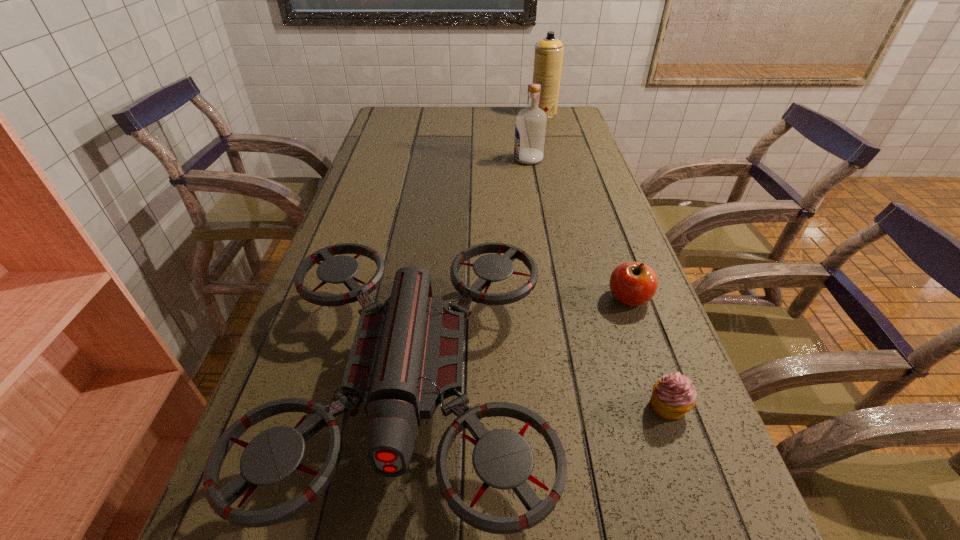
Where is `free space located on the left of the apple`? This screenshot has width=960, height=540. free space located on the left of the apple is located at coordinates (444, 298).

Find the location of a particular element. The image size is (960, 540). vacant area located on the left of the cupcake is located at coordinates (493, 406).

What are the coordinates of `object situated at the far edge` in the screenshot? It's located at (548, 58).

Where is `aerosol can located at the right edge`? The height and width of the screenshot is (540, 960). aerosol can located at the right edge is located at coordinates (548, 58).

Where is `apple that is positioned at the right edge`? apple that is positioned at the right edge is located at coordinates (632, 283).

Locate an element on the screen. cupcake located in the right edge section of the desktop is located at coordinates (672, 396).

The width and height of the screenshot is (960, 540). Find the location of `object located in the far right corner section of the desktop`. object located in the far right corner section of the desktop is located at coordinates (548, 58).

This screenshot has height=540, width=960. In order to click on vacant space at the far edge of the desktop in this screenshot , I will do `click(439, 108)`.

Locate an element on the screen. This screenshot has width=960, height=540. free spot at the left edge of the desktop is located at coordinates (372, 145).

Locate an element on the screen. The width and height of the screenshot is (960, 540). vacant space at the right edge of the desktop is located at coordinates (563, 166).